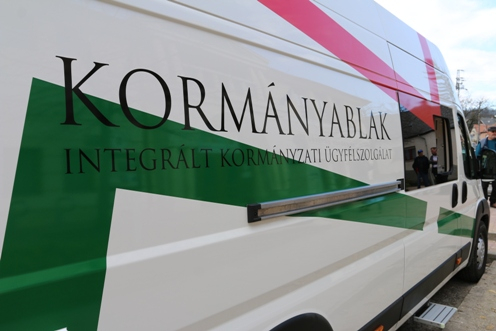
I want to click on window, so pos(428,131), pos(466,156).